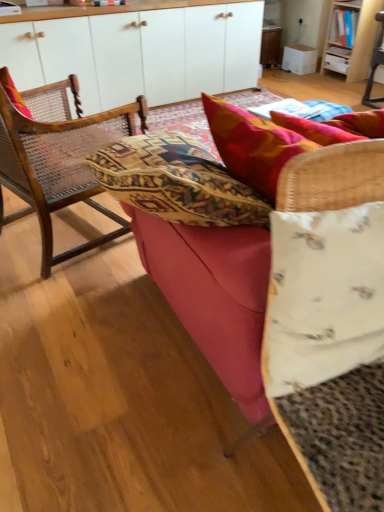
The width and height of the screenshot is (384, 512). Identify the location of vacant area that is in front of woven wood chair at left. (59, 311).